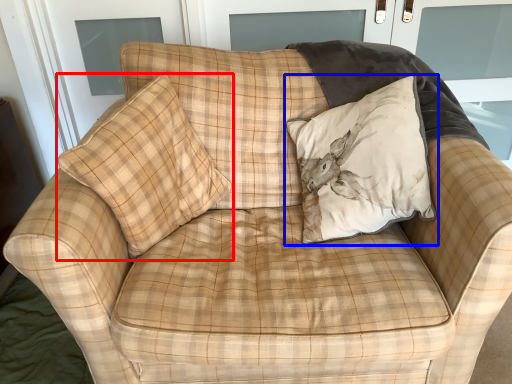
Question: Among these objects, which one is farthest to the camera, pillow (highlighted by a red box) or pillow (highlighted by a blue box)?

Choices:
 (A) pillow
 (B) pillow

Answer: (B)